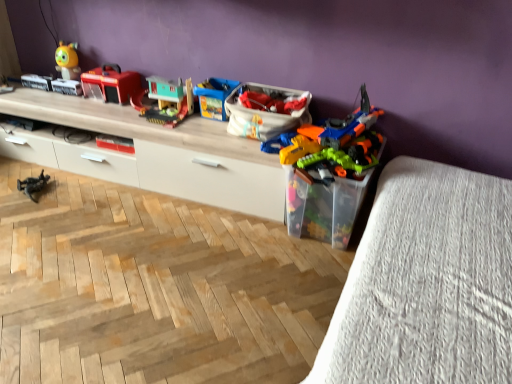
You are a GUI agent. You are given a task and a screenshot of the screen. Output one action in this format:
    pyautogui.click(x=<x>, y=<y>)
    Task: Click on the free space between wooden at upper left and metallic gray toy soldier at lower left, the fifth toy in the right-to-left sequence
    This screenshot has height=384, width=512.
    Given the screenshot: What is the action you would take?
    pyautogui.click(x=105, y=195)